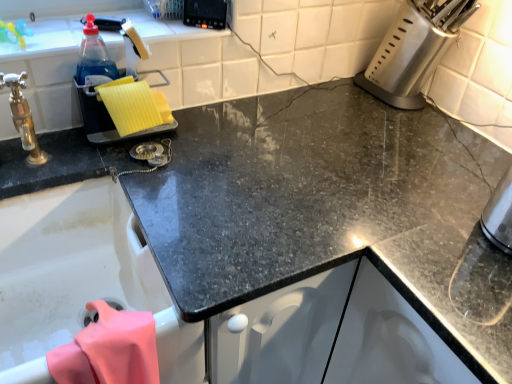
The image size is (512, 384). Identify the location of blank area beneath satin silver knife block at upper right, which appears as the 3th appliance when viewed from the left (from a real-world perspective). (394, 107).